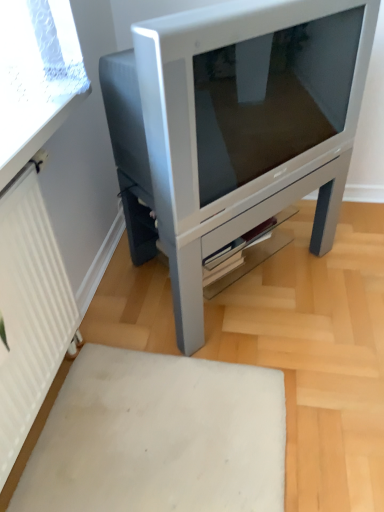
You are a GUI agent. You are given a task and a screenshot of the screen. Output one action in this format:
    pyautogui.click(x=<x>, y=<y>)
    Task: Click on the free point above white matte rug at lower center (from a real-world perspective)
    Image resolution: width=384 pixels, height=512 pixels.
    Given the screenshot: What is the action you would take?
    pyautogui.click(x=161, y=428)